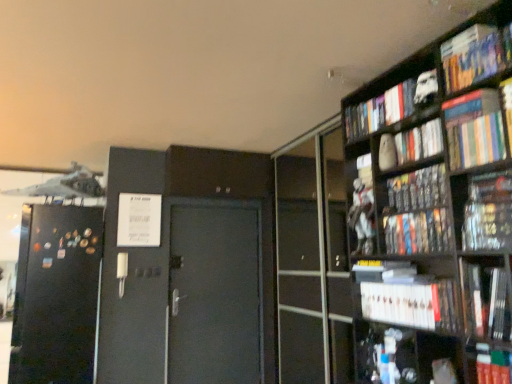
Question: Is metallic silver figure at upper right, the 6th book from the top, oriented away from hardcover book at upper right, which is counted as the first book, starting from the top?

Choices:
 (A) yes
 (B) no

Answer: (B)

Question: Considering the relative sizes of metallic silver figure at upper right, the 6th book from the bottom, and hardcover book at upper right, marked as the 11th book in a bottom-to-top arrangement, in the image provided, is metallic silver figure at upper right, the 6th book from the bottom, bigger than hardcover book at upper right, marked as the 11th book in a bottom-to-top arrangement,?

Choices:
 (A) no
 (B) yes

Answer: (B)

Question: Can you confirm if metallic silver figure at upper right, the 6th book from the bottom, is positioned to the right of hardcover book at upper right, which is counted as the first book, starting from the top?

Choices:
 (A) yes
 (B) no

Answer: (B)

Question: Considering the relative sizes of metallic silver figure at upper right, the 6th book from the bottom, and hardcover book at upper right, marked as the 11th book in a bottom-to-top arrangement, in the image provided, is metallic silver figure at upper right, the 6th book from the bottom, taller than hardcover book at upper right, marked as the 11th book in a bottom-to-top arrangement,?

Choices:
 (A) no
 (B) yes

Answer: (B)

Question: Does metallic silver figure at upper right, the 6th book from the top, have a greater width compared to hardcover book at upper right, marked as the 11th book in a bottom-to-top arrangement?

Choices:
 (A) yes
 (B) no

Answer: (B)

Question: Is metallic silver figure at upper right, the 6th book from the bottom, far from hardcover book at upper right, marked as the 11th book in a bottom-to-top arrangement?

Choices:
 (A) no
 (B) yes

Answer: (A)

Question: Is hardcover book at lower right, the first book positioned from the bottom, thinner than metallic silver figure at upper right, the 6th book from the top?

Choices:
 (A) yes
 (B) no

Answer: (B)

Question: Is hardcover book at lower right, the first book positioned from the bottom, bigger than metallic silver figure at upper right, the 6th book from the top?

Choices:
 (A) yes
 (B) no

Answer: (B)

Question: From the image's perspective, is hardcover book at lower right, positioned as the 11th book in top-to-bottom order, under metallic silver figure at upper right, the 6th book from the bottom?

Choices:
 (A) no
 (B) yes

Answer: (B)

Question: Is metallic silver figure at upper right, the 6th book from the bottom, a part of hardcover book at lower right, the first book positioned from the bottom?

Choices:
 (A) yes
 (B) no

Answer: (B)

Question: From a real-world perspective, is hardcover book at lower right, positioned as the 11th book in top-to-bottom order, on metallic silver figure at upper right, the 6th book from the bottom?

Choices:
 (A) yes
 (B) no

Answer: (B)

Question: Would you say hardcover book at lower right, positioned as the 11th book in top-to-bottom order, is outside metallic silver figure at upper right, the 6th book from the bottom?

Choices:
 (A) no
 (B) yes

Answer: (B)

Question: Can you confirm if hardcover books at upper right, which is counted as the 8th book, starting from the bottom, is bigger than matte black book at upper right, placed as the fifth book when sorted from top to bottom?

Choices:
 (A) yes
 (B) no

Answer: (B)